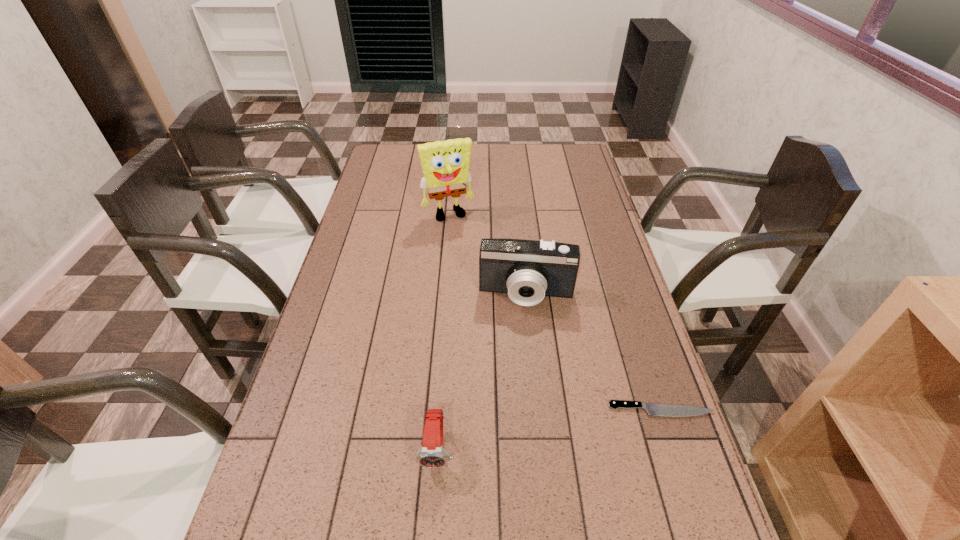
Locate an element on the screen. free space on the desktop that is between the nearest object and the rightmost object and is positioned on the lens of the camcorder is located at coordinates (520, 434).

You are a GUI agent. You are given a task and a screenshot of the screen. Output one action in this format:
    pyautogui.click(x=<x>, y=<y>)
    Task: Click on the free spot on the desktop that is between the nearest object and the third farthest object and is positioned on the face of the farthest object
    The image size is (960, 540).
    Given the screenshot: What is the action you would take?
    pyautogui.click(x=539, y=431)